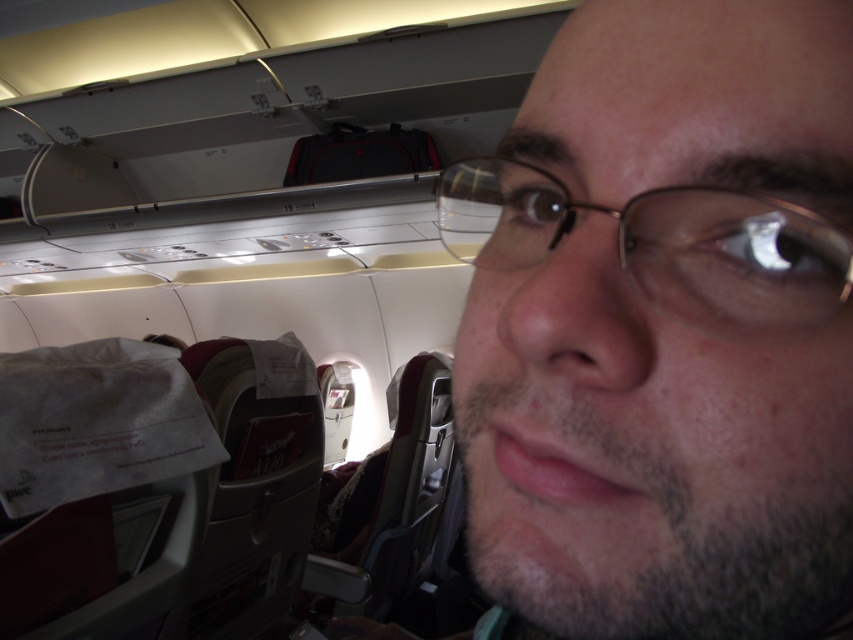
You are a passenger sitting in the airplane cabin and want to reach both the point at (772,488) and the point at (825,273). Which point is closer to you?

Point (825,273) is closer to you because it is less further to the camera than point (772,488).

You are sitting in an airplane seat and notice the smooth skin face at center in front of you. Based on its position, can you estimate whether it is directly in front of you or slightly to one side?

The smooth skin face at center is located at coordinates approximately 0.517 on the x and 0.770 on the y axis. Since the x coordinate is close to 0.5, which is the center point, the face is directly in front of you rather than to the side.